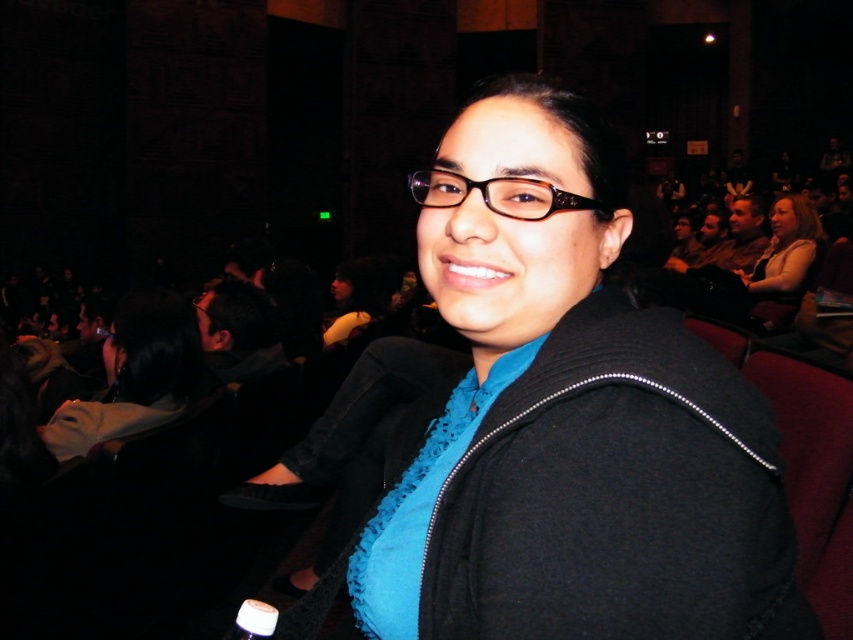
Question: Does matte black jacket at center appear under brown textured glasses at center?

Choices:
 (A) yes
 (B) no

Answer: (A)

Question: Which point is closer to the camera taking this photo?

Choices:
 (A) (83, 406)
 (B) (554, 205)

Answer: (B)

Question: Is matte black jacket at center further to camera compared to brown textured glasses at center?

Choices:
 (A) no
 (B) yes

Answer: (A)

Question: Can you confirm if matte black jacket at center is positioned below brown textured glasses at center?

Choices:
 (A) no
 (B) yes

Answer: (B)

Question: Estimate the real-world distances between objects in this image. Which object is closer to the black fabric jacket at center?

Choices:
 (A) matte black jacket at center
 (B) brown textured glasses at center

Answer: (A)

Question: Which of these objects is positioned closest to the black fabric jacket at center?

Choices:
 (A) matte black jacket at center
 (B) brown textured glasses at center

Answer: (A)